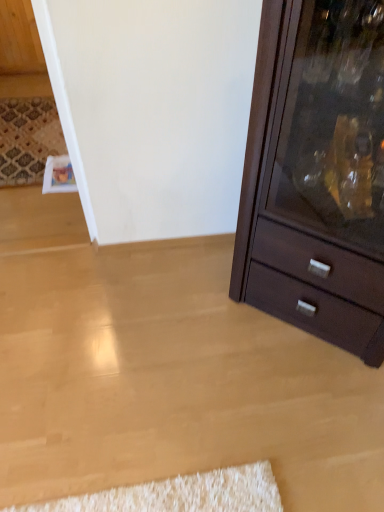
In order to click on free space above patterned fabric mat at upper left (from a real-world perspective) in this screenshot , I will do `click(31, 136)`.